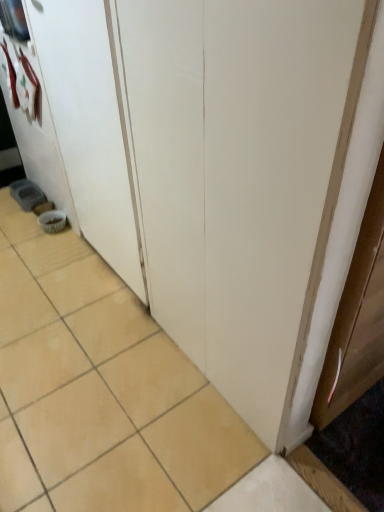
Question: Is beige ceramic tile at lower left oriented towards white matte door at lower left?

Choices:
 (A) no
 (B) yes

Answer: (A)

Question: Is beige ceramic tile at lower left positioned before white matte door at lower left?

Choices:
 (A) no
 (B) yes

Answer: (B)

Question: Is beige ceramic tile at lower left further to the viewer compared to white matte door at lower left?

Choices:
 (A) no
 (B) yes

Answer: (A)

Question: Considering the relative sizes of beige ceramic tile at lower left and white matte door at lower left in the image provided, is beige ceramic tile at lower left smaller than white matte door at lower left?

Choices:
 (A) no
 (B) yes

Answer: (A)

Question: Is beige ceramic tile at lower left outside of white matte door at lower left?

Choices:
 (A) yes
 (B) no

Answer: (A)

Question: Does beige ceramic tile at lower left have a greater height compared to white matte door at lower left?

Choices:
 (A) yes
 (B) no

Answer: (B)

Question: Does white matte door at lower left come in front of beige ceramic tile at lower left?

Choices:
 (A) no
 (B) yes

Answer: (A)

Question: From the image's perspective, is white matte door at lower left on beige ceramic tile at lower left?

Choices:
 (A) yes
 (B) no

Answer: (A)

Question: Is white matte door at lower left shorter than beige ceramic tile at lower left?

Choices:
 (A) yes
 (B) no

Answer: (B)

Question: Considering the relative sizes of white matte door at lower left and beige ceramic tile at lower left in the image provided, is white matte door at lower left thinner than beige ceramic tile at lower left?

Choices:
 (A) yes
 (B) no

Answer: (A)

Question: Does white matte door at lower left appear on the right side of beige ceramic tile at lower left?

Choices:
 (A) yes
 (B) no

Answer: (A)

Question: Is white matte door at lower left oriented away from beige ceramic tile at lower left?

Choices:
 (A) yes
 (B) no

Answer: (B)

Question: Considering the positions of beige ceramic tile at lower left and white matte door at lower left in the image, is beige ceramic tile at lower left taller or shorter than white matte door at lower left?

Choices:
 (A) short
 (B) tall

Answer: (A)